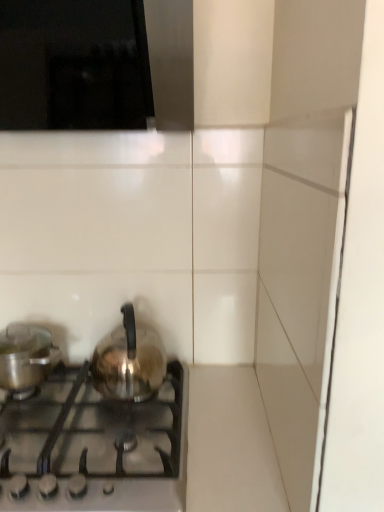
Question: Is shiny metallic kettle at center, the 2th kitchen appliance when ordered from left to right, to the left or to the right of shiny metallic kettle at lower left in the image?

Choices:
 (A) left
 (B) right

Answer: (B)

Question: Relative to shiny metallic kettle at lower left, is shiny metallic kettle at center, the 1th kitchen appliance in the right-to-left sequence, in front or behind?

Choices:
 (A) behind
 (B) front

Answer: (A)

Question: Which is farther from the shiny metallic kettle at center, the 2th kitchen appliance when ordered from left to right?

Choices:
 (A) shiny metallic pot at left, the 2th kitchen appliance from the right
 (B) shiny metallic kettle at lower left

Answer: (A)

Question: Which of these objects is positioned farthest from the shiny metallic kettle at lower left?

Choices:
 (A) shiny metallic pot at left, the 2th kitchen appliance from the right
 (B) shiny metallic kettle at center, the 1th kitchen appliance in the right-to-left sequence

Answer: (A)